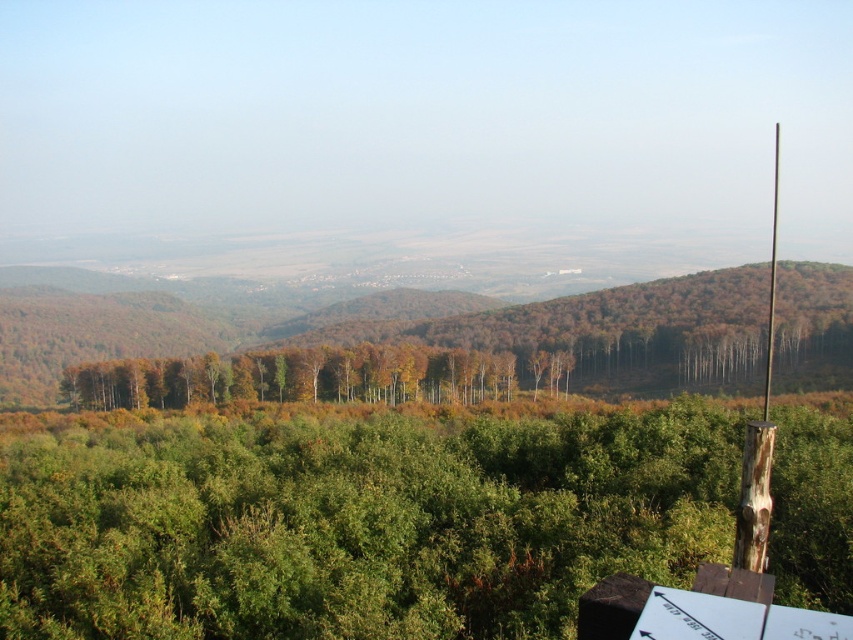
Question: Which object is closer to the camera taking this photo?

Choices:
 (A) green leafy forest at center
 (B) wooden post at right

Answer: (A)

Question: Which point is farther to the camera?

Choices:
 (A) (227, 548)
 (B) (775, 170)

Answer: (B)

Question: In this image, where is green leafy forest at center located relative to wooden post at right?

Choices:
 (A) above
 (B) below

Answer: (B)

Question: Can you confirm if green leafy forest at center is bigger than wooden post at right?

Choices:
 (A) yes
 (B) no

Answer: (B)

Question: Is green leafy forest at center closer to the viewer compared to wooden post at right?

Choices:
 (A) no
 (B) yes

Answer: (B)